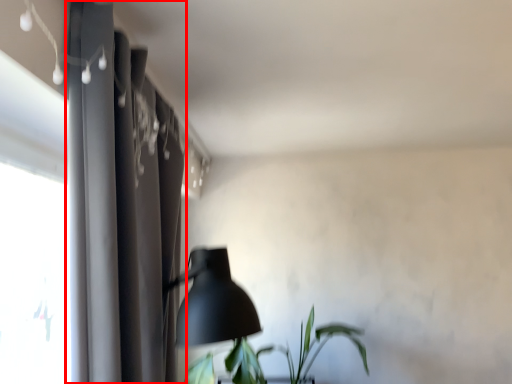
Question: From the image's perspective, considering the relative positions of curtain (annotated by the red box) and houseplant in the image provided, where is curtain (annotated by the red box) located with respect to the staircase?

Choices:
 (A) above
 (B) below

Answer: (A)